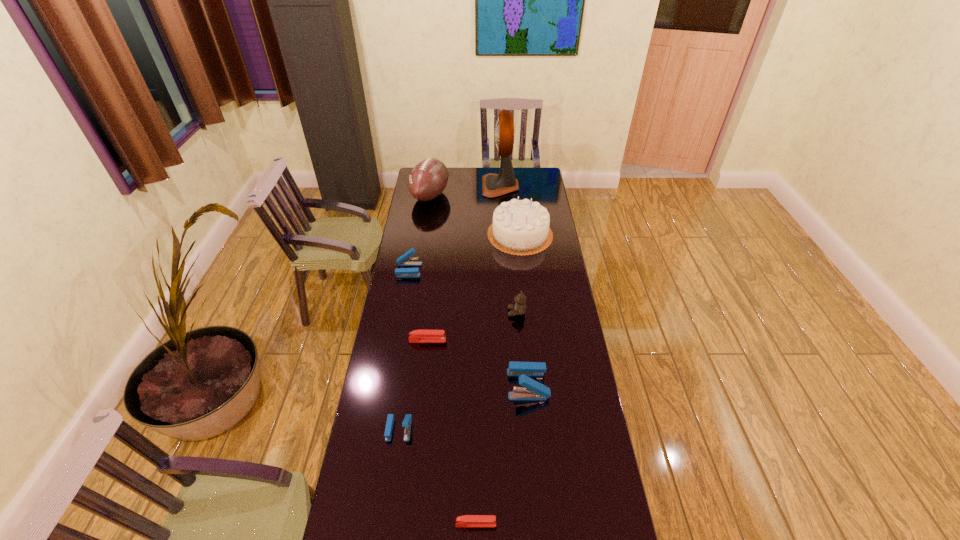
Image resolution: width=960 pixels, height=540 pixels. Identify the location of football (American) located at the far edge. (428, 179).

At what (x,y) coordinates should I click in order to perform the action: click on football (American) present at the left edge. Please return your answer as a coordinate pair (x, y). Image resolution: width=960 pixels, height=540 pixels. Looking at the image, I should click on (428, 179).

At what (x,y) coordinates should I click in order to perform the action: click on birthday cake positioned at the right edge. Please return your answer as a coordinate pair (x, y). The image size is (960, 540). Looking at the image, I should click on (520, 227).

Locate an element on the screen. The width and height of the screenshot is (960, 540). stapler located at the right edge is located at coordinates (534, 391).

The height and width of the screenshot is (540, 960). In order to click on object that is at the far left corner in this screenshot , I will do `click(428, 179)`.

The image size is (960, 540). In the image, there is a desktop. In order to click on free space at the far edge in this screenshot , I will do `click(468, 174)`.

The width and height of the screenshot is (960, 540). In the image, there is a desktop. Identify the location of vacant space at the left edge. (403, 451).

You are a GUI agent. You are given a task and a screenshot of the screen. Output one action in this format:
    pyautogui.click(x=<x>, y=<y>)
    Task: Click on the free space at the right edge
    Image resolution: width=960 pixels, height=540 pixels.
    Given the screenshot: What is the action you would take?
    pyautogui.click(x=557, y=328)

Locate an element on the screen. This screenshot has height=540, width=960. empty location between the tallest object and the fourth nearest stapler is located at coordinates (464, 264).

Locate an element on the screen. vacant area between the fourth nearest object and the brown fan is located at coordinates 464,264.